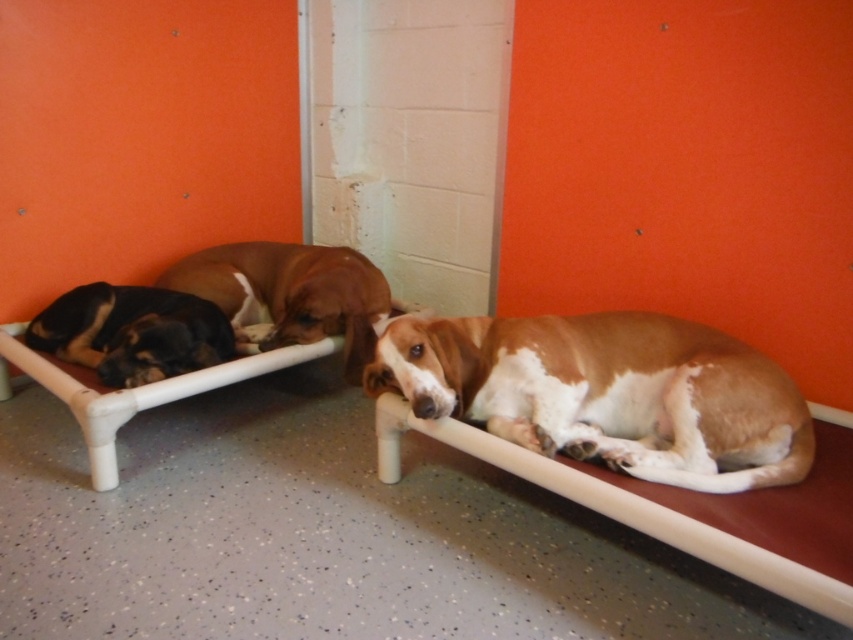
Question: Is brown/white fur dog at center positioned at the back of brown fur at center?

Choices:
 (A) yes
 (B) no

Answer: (B)

Question: Which is nearer to the black and tan fur at left?

Choices:
 (A) brown/white fur dog at center
 (B) brown fur at center

Answer: (B)

Question: Does brown/white fur dog at center have a lesser width compared to brown fur at center?

Choices:
 (A) no
 (B) yes

Answer: (A)

Question: Which object appears farthest from the camera in this image?

Choices:
 (A) black and tan fur at left
 (B) brown/white fur dog at center
 (C) brown fur at center

Answer: (C)

Question: Does brown/white fur dog at center appear under brown fur at center?

Choices:
 (A) no
 (B) yes

Answer: (B)

Question: Which object is positioned farthest from the brown fur at center?

Choices:
 (A) brown/white fur dog at center
 (B) black and tan fur at left

Answer: (A)